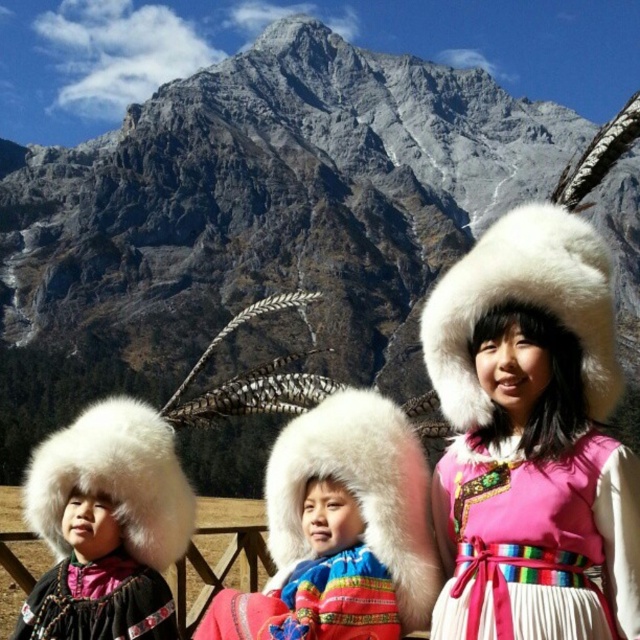
Is point (273, 608) farther from camera compared to point (204, 632)?

No, (273, 608) is closer to viewer.

Is white fur hat at center to the left of multicolored woolen scarf at center from the viewer's perspective?

Incorrect, white fur hat at center is not on the left side of multicolored woolen scarf at center.

Where is `white fur hat at center`? This screenshot has width=640, height=640. white fur hat at center is located at coordinates 340,531.

Which is more to the left, gray rocky mountain at upper center or multicolored woolen scarf at center?

multicolored woolen scarf at center

Describe the element at coordinates (256, 216) in the screenshot. I see `gray rocky mountain at upper center` at that location.

This screenshot has width=640, height=640. In order to click on gray rocky mountain at upper center in this screenshot , I will do `click(256, 216)`.

Which is more to the left, gray rocky mountain at upper center or white fur hat at center?

Positioned to the left is white fur hat at center.

Locate an element on the screen. Image resolution: width=640 pixels, height=640 pixels. gray rocky mountain at upper center is located at coordinates (256, 216).

Where is `gray rocky mountain at upper center`? Image resolution: width=640 pixels, height=640 pixels. gray rocky mountain at upper center is located at coordinates (256, 216).